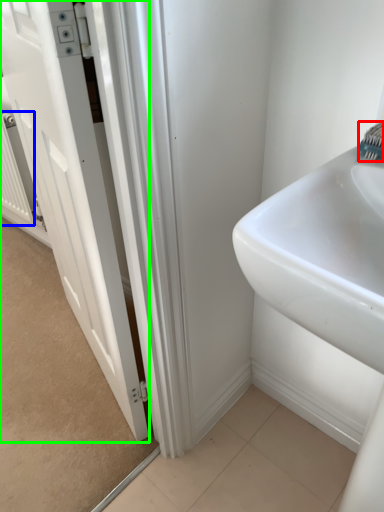
Question: Which is nearer to the brush (highlighted by a red box)? radiator (highlighted by a blue box) or door (highlighted by a green box).

Choices:
 (A) radiator
 (B) door

Answer: (B)